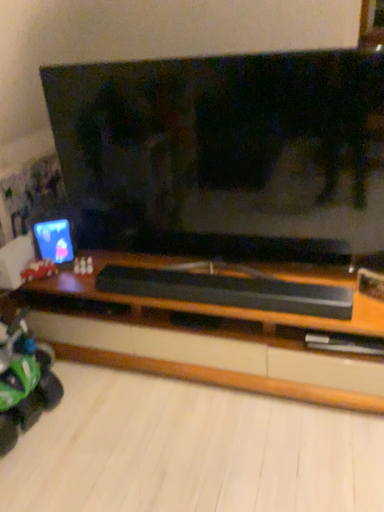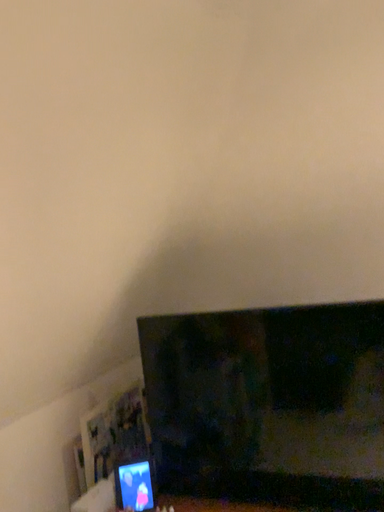
Question: Which way did the camera rotate in the video?

Choices:
 (A) rotated left
 (B) rotated right

Answer: (A)